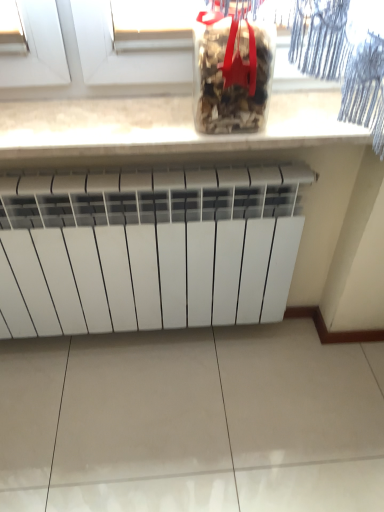
You are a GUI agent. You are given a task and a screenshot of the screen. Output one action in this format:
    pyautogui.click(x=<x>, y=<y>)
    Task: Click on the free location to the right of transparent plastic container at upper center
    Image resolution: width=384 pixels, height=512 pixels.
    Given the screenshot: What is the action you would take?
    pyautogui.click(x=304, y=110)